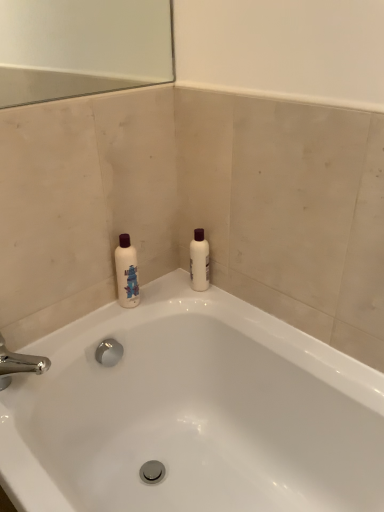
Where is `vacant space to the left of white matte bottle at upper right`? The image size is (384, 512). vacant space to the left of white matte bottle at upper right is located at coordinates (167, 288).